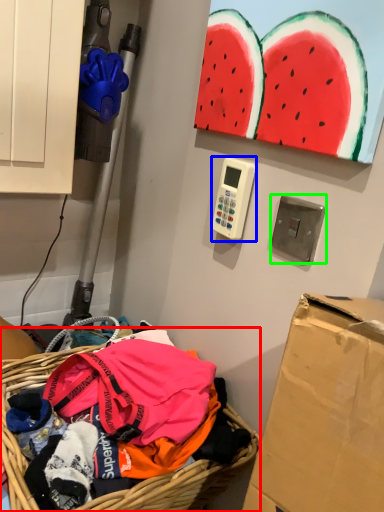
Question: Which object is the farthest from basket (highlighted by a red box)? Choose among these: scale (highlighted by a blue box) or light switch (highlighted by a green box).

Choices:
 (A) scale
 (B) light switch

Answer: (B)